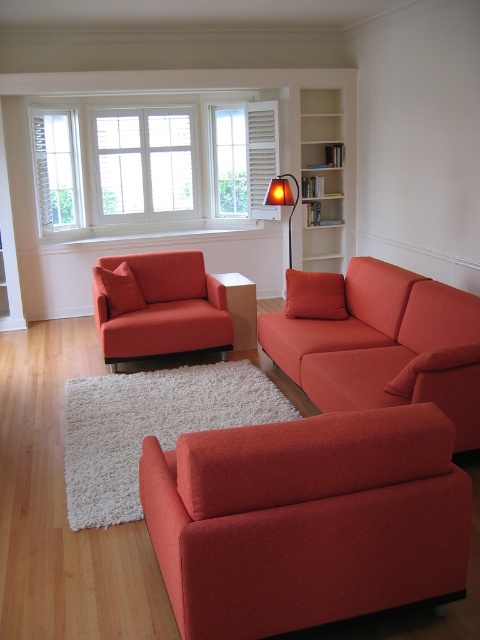
Who is more forward, (212,192) or (283,182)?

Point (283,182) is in front.

In the scene shown: Who is shorter, white wood shutters at upper center or orange fabric lamp at center?

Standing shorter between the two is orange fabric lamp at center.

Find the location of a particular element. white wood shutters at upper center is located at coordinates (155, 164).

Can you confirm if white wood bookshelf at upper center is positioned to the left of orange fabric lamp at center?

Incorrect, white wood bookshelf at upper center is not on the left side of orange fabric lamp at center.

Which of these two, white wood bookshelf at upper center or orange fabric lamp at center, stands shorter?

orange fabric lamp at center

In order to click on white wood bookshelf at upper center in this screenshot , I will do `click(322, 179)`.

What do you see at coordinates (307, 518) in the screenshot? I see `matte orange armchair at lower center` at bounding box center [307, 518].

Who is more forward, (213,608) or (180,184)?

Point (213,608) is in front.

Which is in front, point (380, 416) or point (149, 173)?

Positioned in front is point (380, 416).

This screenshot has height=640, width=480. In order to click on matte orange armchair at lower center in this screenshot , I will do `click(307, 518)`.